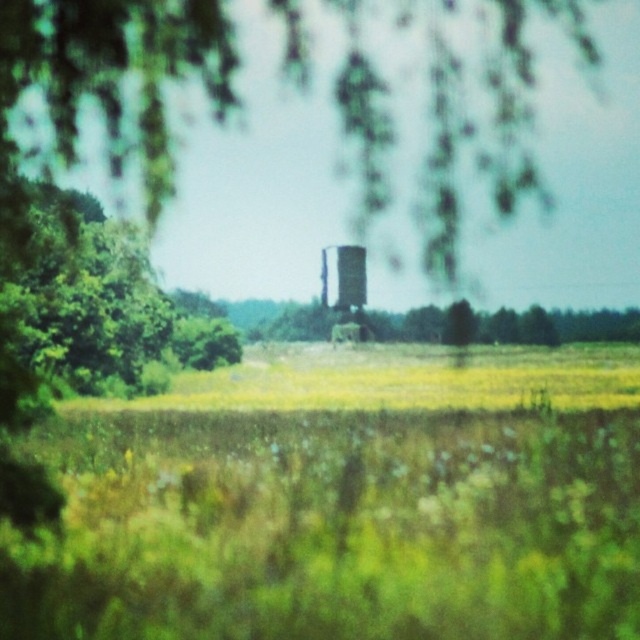
You are standing at the point marked by point (100, 307) in the rural landscape. What object is located at that point?

The point (100, 307) marks the green leafy tree at left.

You are standing in the rural landscape depicted in the image. You want to take a photo of the green leafy tree at left from a distance that is exactly 13.47 meters away. Is this possible given your current position?

Yes, because the green leafy tree at left and the viewer are exactly 13.47 meters apart from each other, so you can take the photo from your current position which is exactly 13.47 meters away.